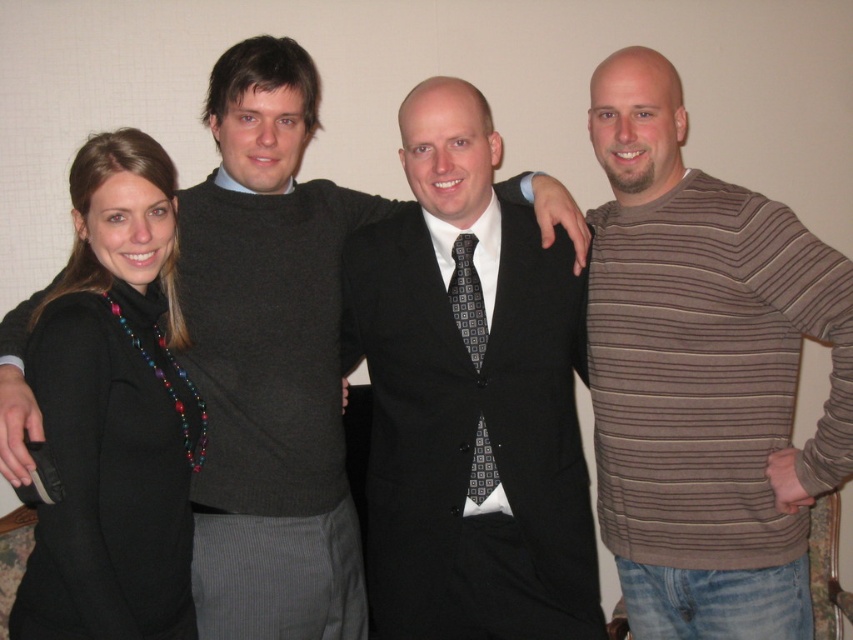
Question: Which object appears farthest from the camera in this image?

Choices:
 (A) black matte coat at left
 (B) matte black suit at center
 (C) brown striped sweater at right

Answer: (B)

Question: Can you confirm if black matte coat at left is wider than black textured tie at center?

Choices:
 (A) yes
 (B) no

Answer: (A)

Question: Can you confirm if matte black suit at center is positioned to the right of black matte coat at left?

Choices:
 (A) no
 (B) yes

Answer: (B)

Question: Which of the following is the closest to the observer?

Choices:
 (A) (437, 365)
 (B) (225, 513)
 (C) (834, 273)

Answer: (C)

Question: Is brown striped sweater at right positioned in front of black sweater at left?

Choices:
 (A) no
 (B) yes

Answer: (B)

Question: Which object appears farthest from the camera in this image?

Choices:
 (A) matte black suit at center
 (B) brown striped sweater at right
 (C) black sweater at left

Answer: (C)